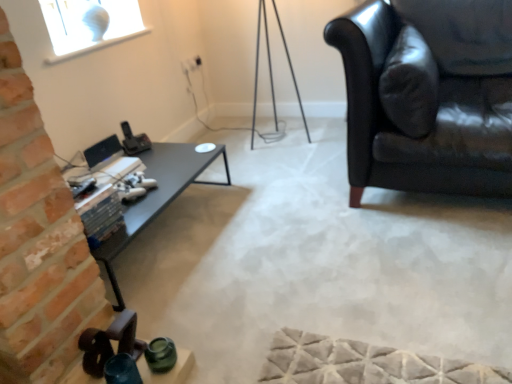
Find the location of a particular element. Image resolution: width=512 pixels, height=384 pixels. spots to the right of black glossy table at left is located at coordinates (276, 222).